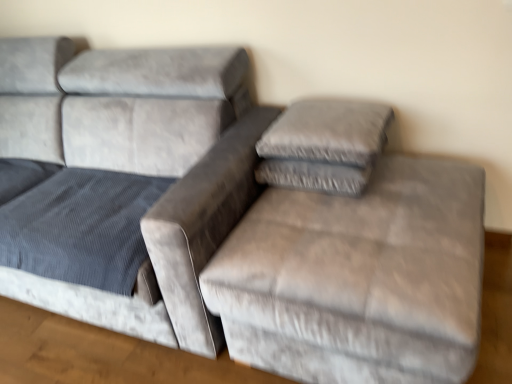
Identify the location of velvet gray ottoman at center. (352, 256).

This screenshot has width=512, height=384. What do you see at coordinates (352, 256) in the screenshot?
I see `velvet gray ottoman at center` at bounding box center [352, 256].

This screenshot has width=512, height=384. Identify the location of velvet gray ottoman at center. (352, 256).